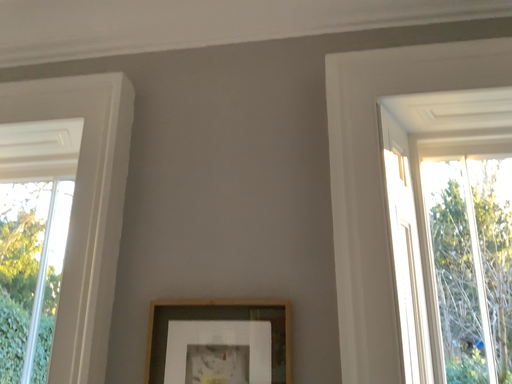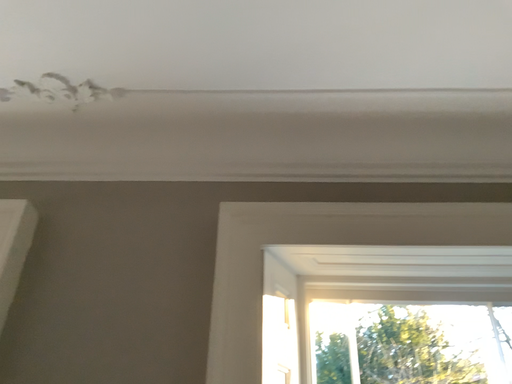
Question: Which way did the camera rotate in the video?

Choices:
 (A) rotated left
 (B) rotated right

Answer: (B)